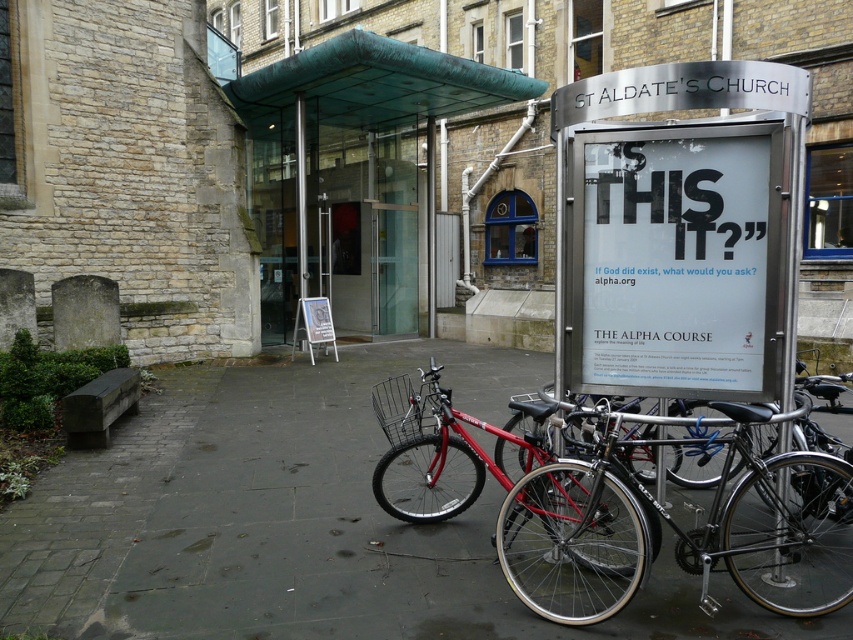
Question: Which of the following is the closest to the observer?

Choices:
 (A) shiny red bicycle at center
 (B) transparent glass bus stop at upper center

Answer: (A)

Question: Does paved stone pavement at center appear on the right side of shiny black bicycle at center?

Choices:
 (A) yes
 (B) no

Answer: (B)

Question: Is white paper sign at center wider than shiny black bicycle at center?

Choices:
 (A) no
 (B) yes

Answer: (A)

Question: Which object is the farthest from the paved stone pavement at center?

Choices:
 (A) shiny black bicycle at center
 (B) transparent glass bus stop at upper center

Answer: (B)

Question: Is transparent glass bus stop at upper center in front of shiny black bicycle at center?

Choices:
 (A) no
 (B) yes

Answer: (A)

Question: Among these objects, which one is farthest from the camera?

Choices:
 (A) white paper sign at center
 (B) shiny black bicycle at center
 (C) shiny red bicycle at center

Answer: (C)